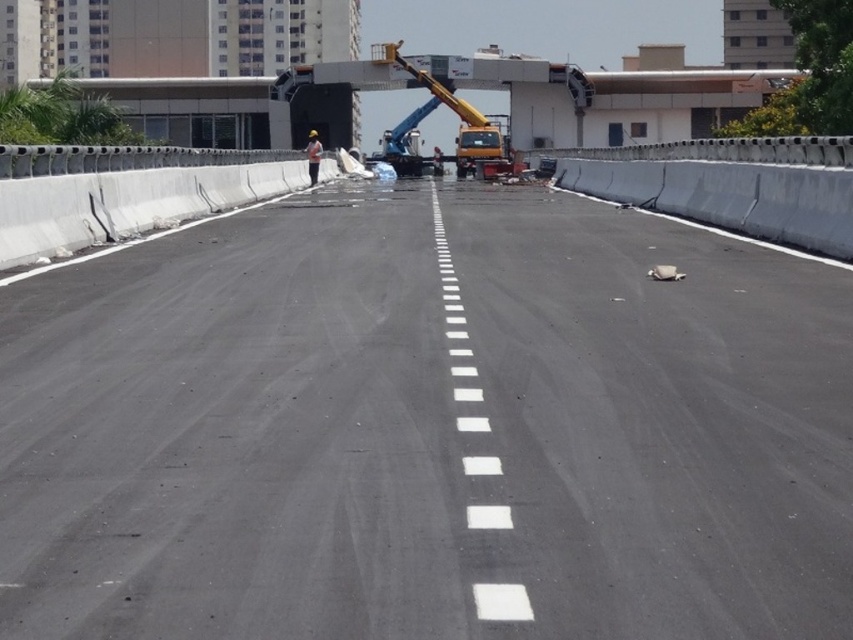
Question: Which is nearer to the white reflective vest at center?

Choices:
 (A) yellow metallic crane at center
 (B) black asphalt highway at center

Answer: (A)

Question: Based on their relative distances, which object is nearer to the black asphalt highway at center?

Choices:
 (A) white reflective vest at center
 (B) yellow metallic crane at center

Answer: (A)

Question: Estimate the real-world distances between objects in this image. Which object is closer to the yellow metallic crane at center?

Choices:
 (A) black asphalt highway at center
 (B) white reflective vest at center

Answer: (B)

Question: Does black asphalt highway at center lie behind yellow metallic crane at center?

Choices:
 (A) yes
 (B) no

Answer: (B)

Question: Can you confirm if black asphalt highway at center is smaller than white reflective vest at center?

Choices:
 (A) yes
 (B) no

Answer: (A)

Question: Is yellow metallic crane at center bigger than white reflective vest at center?

Choices:
 (A) no
 (B) yes

Answer: (B)